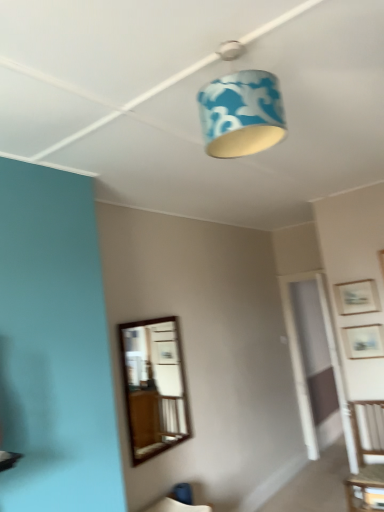
Question: Does blue fabric lampshade at upper center have a lesser width compared to wooden chair at right?

Choices:
 (A) no
 (B) yes

Answer: (B)

Question: Is blue fabric lampshade at upper center taller than wooden chair at right?

Choices:
 (A) yes
 (B) no

Answer: (B)

Question: From a real-world perspective, is blue fabric lampshade at upper center under wooden chair at right?

Choices:
 (A) yes
 (B) no

Answer: (B)

Question: Is blue fabric lampshade at upper center further to camera compared to wooden chair at right?

Choices:
 (A) yes
 (B) no

Answer: (B)

Question: Is wooden chair at right completely or partially inside blue fabric lampshade at upper center?

Choices:
 (A) no
 (B) yes

Answer: (A)

Question: From the image's perspective, is blue fabric lampshade at upper center below wooden chair at right?

Choices:
 (A) no
 (B) yes

Answer: (A)

Question: Does wooden picture frame at upper right, placed as the second picture frame when sorted from bottom to top, have a larger size compared to wooden picture frame at upper right, placed as the second picture frame when sorted from top to bottom?

Choices:
 (A) yes
 (B) no

Answer: (B)

Question: From the image's perspective, is wooden picture frame at upper right, placed as the second picture frame when sorted from bottom to top, beneath wooden picture frame at upper right, placed as the second picture frame when sorted from top to bottom?

Choices:
 (A) yes
 (B) no

Answer: (B)

Question: Is wooden picture frame at upper right, placed as the second picture frame when sorted from bottom to top, next to wooden picture frame at upper right, placed as the second picture frame when sorted from top to bottom?

Choices:
 (A) no
 (B) yes

Answer: (A)

Question: From a real-world perspective, is wooden picture frame at upper right, placed as the second picture frame when sorted from bottom to top, physically below wooden picture frame at upper right, which appears as the 1th picture frame when ordered from the bottom?

Choices:
 (A) yes
 (B) no

Answer: (B)

Question: Can you confirm if wooden picture frame at upper right, which is the 1th picture frame from top to bottom, is shorter than wooden picture frame at upper right, placed as the second picture frame when sorted from top to bottom?

Choices:
 (A) no
 (B) yes

Answer: (B)

Question: Could you tell me if wooden picture frame at upper right, placed as the second picture frame when sorted from bottom to top, is facing wooden picture frame at upper right, which appears as the 1th picture frame when ordered from the bottom?

Choices:
 (A) no
 (B) yes

Answer: (A)

Question: From a real-world perspective, is wooden picture frame at upper right, which is the 1th picture frame from top to bottom, under wooden table at lower right?

Choices:
 (A) yes
 (B) no

Answer: (B)